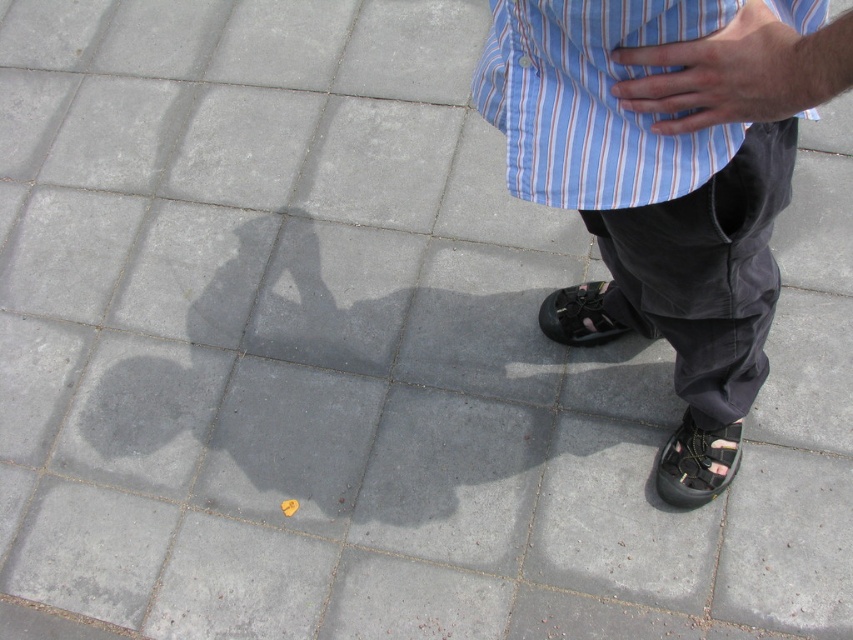
Question: Estimate the real-world distances between objects in this image. Which object is closer to the black leather shoe at lower right?

Choices:
 (A) blue striped shirt at center
 (B) black leather shoe at lower center
 (C) matte black sandals at lower right

Answer: (B)

Question: Does blue striped shirt at center appear over black leather shoe at lower right?

Choices:
 (A) no
 (B) yes

Answer: (B)

Question: Estimate the real-world distances between objects in this image. Which object is closer to the black leather shoe at lower center?

Choices:
 (A) smooth skin hand at center
 (B) blue striped shirt at center

Answer: (B)

Question: Does blue striped shirt at center appear over smooth skin hand at center?

Choices:
 (A) no
 (B) yes

Answer: (B)

Question: Is black leather shoe at lower right wider than black leather shoe at lower center?

Choices:
 (A) yes
 (B) no

Answer: (B)

Question: Which point is farther to the camera?

Choices:
 (A) (x=761, y=42)
 (B) (x=589, y=323)
 (C) (x=656, y=484)
 (D) (x=553, y=60)

Answer: (B)